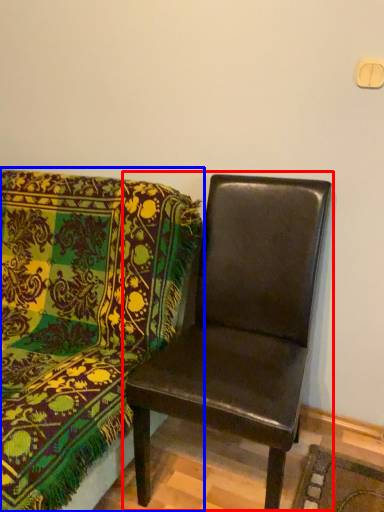
Question: Which of the following is the closest to the observer, chair (highlighted by a red box) or chair (highlighted by a blue box)?

Choices:
 (A) chair
 (B) chair

Answer: (B)